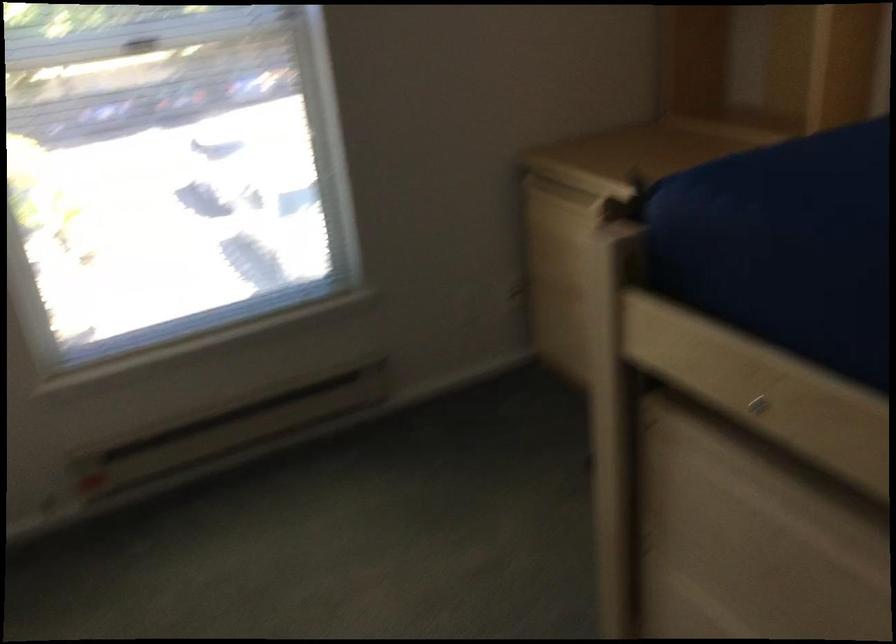
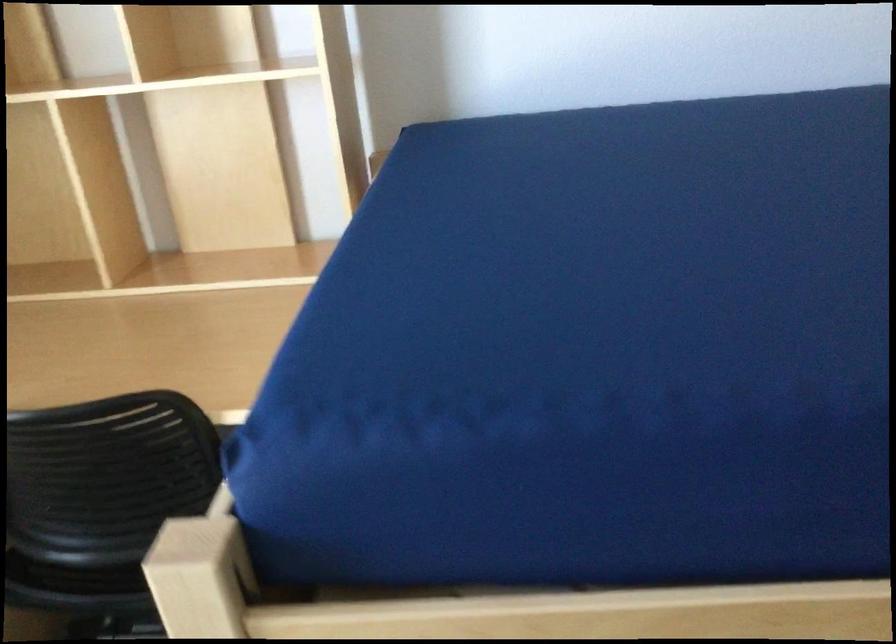
Question: The camera is either moving clockwise (left) or counter-clockwise (right) around the object. The first image is from the beginning of the video and the second image is from the end. Is the camera moving left or right when shooting the video?

Choices:
 (A) Left
 (B) Right

Answer: (A)